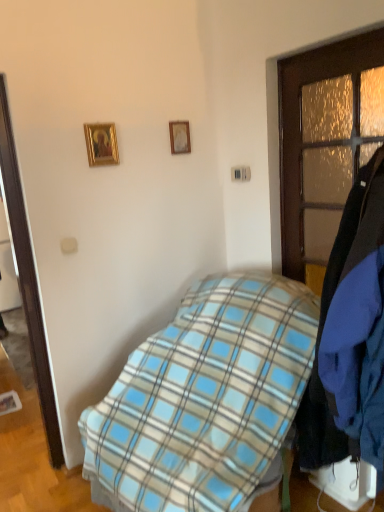
Question: Does wooden picture frame at upper center, the 2th picture frame from the left, lie behind gold-framed picture at upper left, the 2th picture frame in the back-to-front sequence?

Choices:
 (A) yes
 (B) no

Answer: (A)

Question: Is wooden picture frame at upper center, the 1th picture frame in the right-to-left sequence, turned away from gold-framed picture at upper left, arranged as the 2th picture frame when viewed from the right?

Choices:
 (A) no
 (B) yes

Answer: (A)

Question: Considering the relative positions of wooden picture frame at upper center, which is the second picture frame from front to back, and gold-framed picture at upper left, arranged as the 2th picture frame when viewed from the right, in the image provided, is wooden picture frame at upper center, which is the second picture frame from front to back, in front of gold-framed picture at upper left, arranged as the 2th picture frame when viewed from the right,?

Choices:
 (A) yes
 (B) no

Answer: (B)

Question: Can you confirm if wooden picture frame at upper center, which is the second picture frame from front to back, is taller than gold-framed picture at upper left, the first picture frame viewed from the front?

Choices:
 (A) no
 (B) yes

Answer: (A)

Question: From a real-world perspective, is wooden picture frame at upper center, which is the second picture frame from front to back, located higher than gold-framed picture at upper left, the first picture frame viewed from the front?

Choices:
 (A) no
 (B) yes

Answer: (B)

Question: Considering the relative sizes of wooden picture frame at upper center, which is the second picture frame from front to back, and gold-framed picture at upper left, the 2th picture frame in the back-to-front sequence, in the image provided, is wooden picture frame at upper center, which is the second picture frame from front to back, wider than gold-framed picture at upper left, the 2th picture frame in the back-to-front sequence,?

Choices:
 (A) no
 (B) yes

Answer: (A)

Question: Does gold-framed picture at upper left, the 2th picture frame in the back-to-front sequence, have a lesser width compared to wooden door at right?

Choices:
 (A) yes
 (B) no

Answer: (A)

Question: Could you tell me if gold-framed picture at upper left, arranged as the 2th picture frame when viewed from the right, is turned towards wooden door at right?

Choices:
 (A) yes
 (B) no

Answer: (B)

Question: Is gold-framed picture at upper left, arranged as the 2th picture frame when viewed from the right, to the right of wooden door at right from the viewer's perspective?

Choices:
 (A) no
 (B) yes

Answer: (A)

Question: Does gold-framed picture at upper left, the first picture frame viewed from the front, have a greater width compared to wooden door at right?

Choices:
 (A) yes
 (B) no

Answer: (B)

Question: From the image's perspective, does gold-framed picture at upper left, the first picture frame viewed from the front, appear higher than wooden door at right?

Choices:
 (A) no
 (B) yes

Answer: (B)

Question: Can you confirm if gold-framed picture at upper left, the first picture frame when ordered from left to right, is positioned to the left of wooden door at right?

Choices:
 (A) no
 (B) yes

Answer: (B)

Question: Is wooden picture frame at upper center, the 1th picture frame in the right-to-left sequence, oriented away from blue plaid blanket at center?

Choices:
 (A) yes
 (B) no

Answer: (B)